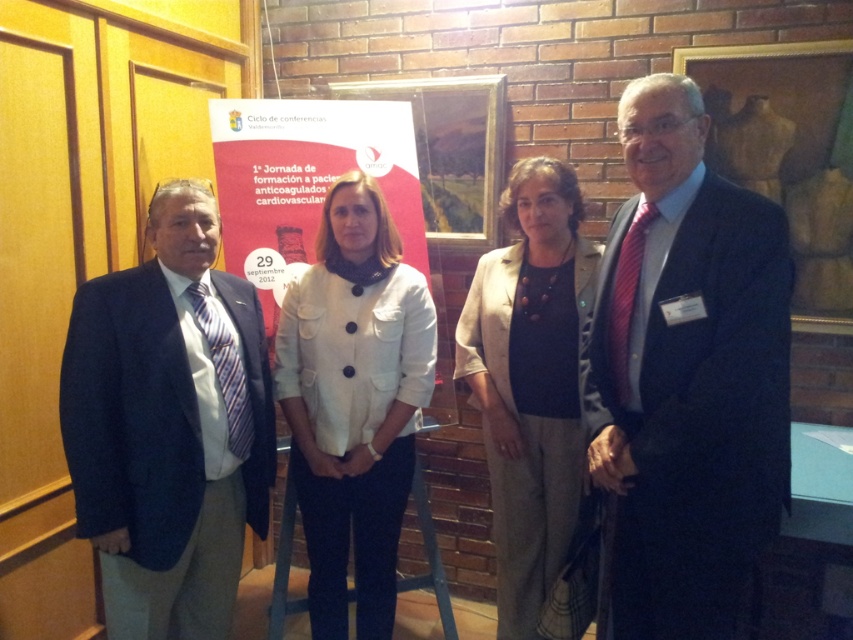
Who is shorter, dark blue suit at center or matte red poster at center?

matte red poster at center

Is dark blue suit at center wider than matte red poster at center?

Incorrect, dark blue suit at center's width does not surpass matte red poster at center's.

Does point (601, 358) come closer to viewer compared to point (230, 264)?

Yes.

Where is `dark blue suit at center`? The height and width of the screenshot is (640, 853). dark blue suit at center is located at coordinates (688, 378).

Can you confirm if blue suit at left is positioned above matte red poster at center?

Actually, blue suit at left is below matte red poster at center.

Is point (213, 605) positioned behind point (287, 166)?

No, it is in front of (287, 166).

At what (x,y) coordinates should I click in order to perform the action: click on blue suit at left. Please return your answer as a coordinate pair (x, y). Looking at the image, I should click on (167, 426).

Is dark blue suit at center in front of white matte jacket at center?

Yes, it is in front of white matte jacket at center.

Does dark blue suit at center appear under white matte jacket at center?

No, dark blue suit at center is not below white matte jacket at center.

Between point (601, 444) and point (379, 384), which one is positioned in front?

Positioned in front is point (601, 444).

The width and height of the screenshot is (853, 640). In order to click on dark blue suit at center in this screenshot , I will do `click(688, 378)`.